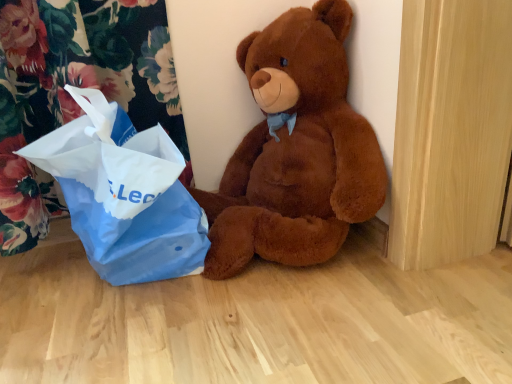
Question: Would you say blue paper bag at left is to the left or to the right of brown plush teddy bear at center in the picture?

Choices:
 (A) right
 (B) left

Answer: (B)

Question: Do you think blue paper bag at left is within brown plush teddy bear at center, or outside of it?

Choices:
 (A) outside
 (B) inside

Answer: (A)

Question: From a real-world perspective, is blue paper bag at left above or below brown plush teddy bear at center?

Choices:
 (A) below
 (B) above

Answer: (A)

Question: From their relative heights in the image, would you say brown plush teddy bear at center is taller or shorter than blue paper bag at left?

Choices:
 (A) short
 (B) tall

Answer: (B)

Question: Considering the positions of brown plush teddy bear at center and blue paper bag at left in the image, is brown plush teddy bear at center bigger or smaller than blue paper bag at left?

Choices:
 (A) small
 (B) big

Answer: (B)

Question: Relative to blue paper bag at left, is brown plush teddy bear at center in front or behind?

Choices:
 (A) behind
 (B) front

Answer: (B)

Question: Looking at their shapes, would you say brown plush teddy bear at center is wider or thinner than blue paper bag at left?

Choices:
 (A) thin
 (B) wide

Answer: (B)